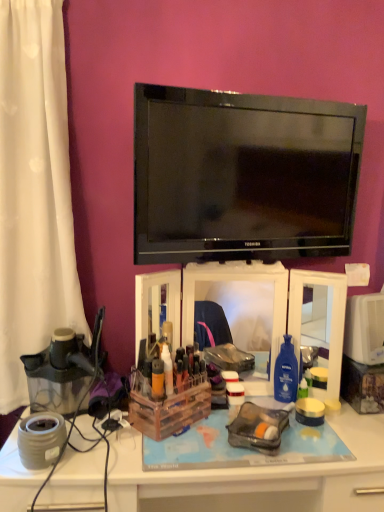
Locate an element on the screen. This screenshot has width=384, height=512. free point above white plastic desk at lower center (from a real-world perspective) is located at coordinates (238, 438).